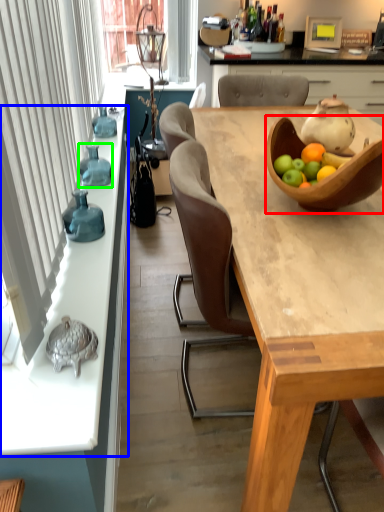
Question: Estimate the real-world distances between objects in this image. Which object is closer to tableware (highlighted by a red box), countertop (highlighted by a blue box) or vase (highlighted by a green box)?

Choices:
 (A) countertop
 (B) vase

Answer: (A)